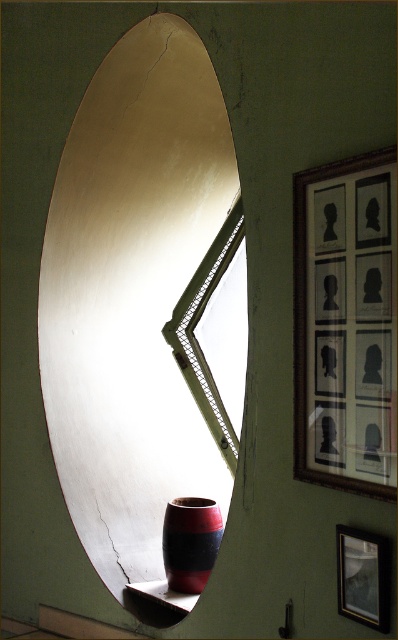
Based on the photo, which of these two, matte red and black vase at lower center or matte black picture frame at upper right, stands shorter?

Standing shorter between the two is matte black picture frame at upper right.

Measure the distance between matte red and black vase at lower center and camera.

matte red and black vase at lower center and camera are 2.79 meters apart.

Locate an element on the screen. The image size is (398, 640). matte red and black vase at lower center is located at coordinates (189, 541).

Does metallic gold mirror at center appear over matte red and black vase at lower center?

Correct, metallic gold mirror at center is located above matte red and black vase at lower center.

Locate an element on the screen. metallic gold mirror at center is located at coordinates pos(134,298).

Where is `metallic gold mirror at center`? This screenshot has height=640, width=398. metallic gold mirror at center is located at coordinates (134, 298).

Identify the location of wooden framed portraits at upper right. (345, 324).

Which is behind, point (386, 243) or point (319, 314)?

The point (319, 314) is behind.

Is point (392, 262) positioned behind point (325, 305)?

No.

In order to click on wooden framed portraits at upper right in this screenshot , I will do `click(345, 324)`.